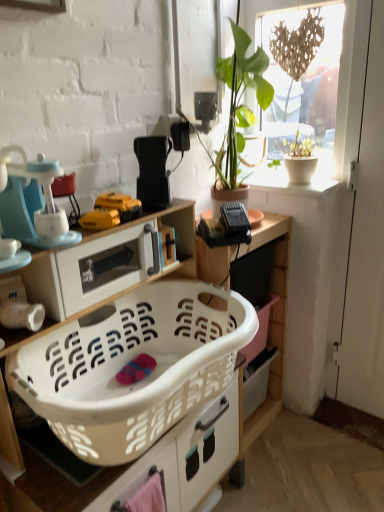
Question: Is yellow plastic drill at center, which ranks as the 2th toy in front-to-back order, shorter than green leafy plant at upper right?

Choices:
 (A) yes
 (B) no

Answer: (A)

Question: Is yellow plastic drill at center, which ranks as the 2th toy in front-to-back order, outside green leafy plant at upper right?

Choices:
 (A) no
 (B) yes

Answer: (B)

Question: From a real-world perspective, does yellow plastic drill at center, which ranks as the 2th toy in front-to-back order, sit lower than green leafy plant at upper right?

Choices:
 (A) no
 (B) yes

Answer: (B)

Question: Can green leafy plant at upper right be found inside yellow plastic drill at center, which is the first toy in back-to-front order?

Choices:
 (A) yes
 (B) no

Answer: (B)

Question: Is yellow plastic drill at center, which ranks as the 2th toy in front-to-back order, at the right side of green leafy plant at upper right?

Choices:
 (A) no
 (B) yes

Answer: (A)

Question: Is yellow plastic drill at center, which is the first toy in back-to-front order, thinner than green leafy plant at upper right?

Choices:
 (A) no
 (B) yes

Answer: (B)

Question: Is white glossy microwave at upper left, which is the first appliance from bottom to top, at the back of white plastic laundry basket at lower center, placed as the 1th cabinetry when sorted from front to back?

Choices:
 (A) yes
 (B) no

Answer: (A)

Question: Does white plastic laundry basket at lower center, placed as the second cabinetry when sorted from back to front, have a greater height compared to white glossy microwave at upper left, the third appliance when ordered from top to bottom?

Choices:
 (A) yes
 (B) no

Answer: (A)

Question: From the image's perspective, would you say white plastic laundry basket at lower center, placed as the 1th cabinetry when sorted from front to back, is shown under white glossy microwave at upper left, which is the first appliance from bottom to top?

Choices:
 (A) yes
 (B) no

Answer: (A)

Question: From a real-world perspective, is white plastic laundry basket at lower center, placed as the second cabinetry when sorted from back to front, on top of white glossy microwave at upper left, the third appliance when ordered from top to bottom?

Choices:
 (A) yes
 (B) no

Answer: (B)

Question: Does white plastic laundry basket at lower center, placed as the second cabinetry when sorted from back to front, have a smaller size compared to white glossy microwave at upper left, the third appliance when ordered from top to bottom?

Choices:
 (A) no
 (B) yes

Answer: (A)

Question: Does white plastic laundry basket at lower center, placed as the second cabinetry when sorted from back to front, appear on the left side of white glossy microwave at upper left, which is the first appliance from bottom to top?

Choices:
 (A) yes
 (B) no

Answer: (B)

Question: Is white plastic laundry basket at lower center, placed as the 1th cabinetry when sorted from front to back, beside white plastic cabinet at center, the first cabinetry positioned from the back?

Choices:
 (A) no
 (B) yes

Answer: (A)